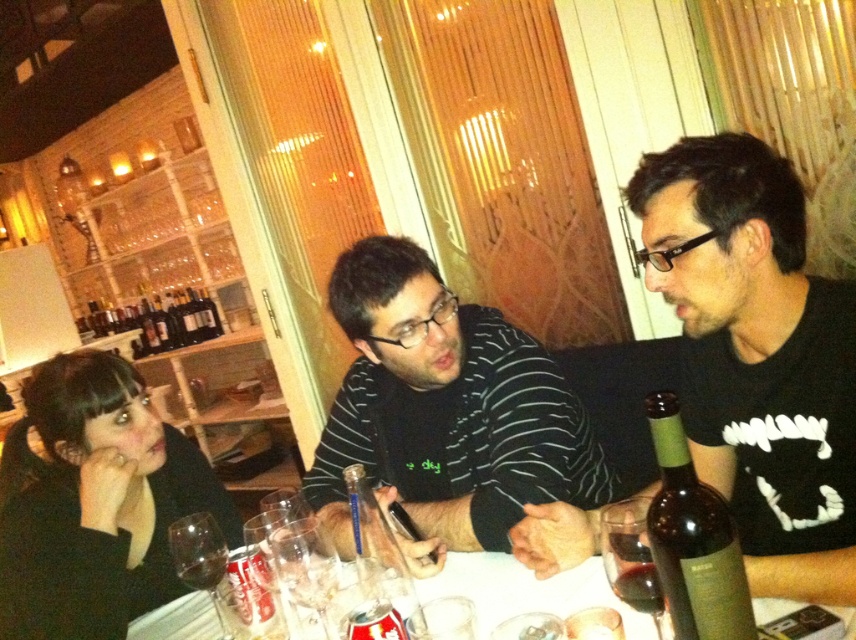
Does clear glass at table center lie behind dark brown glass bottle at center?

No, it is in front of dark brown glass bottle at center.

Does clear glass at table center appear on the right side of dark brown glass bottle at center?

Indeed, clear glass at table center is positioned on the right side of dark brown glass bottle at center.

Between point (193, 552) and point (143, 300), which one is positioned behind?

Point (143, 300)

This screenshot has width=856, height=640. In order to click on clear glass at table center in this screenshot , I will do `click(201, 566)`.

Can you confirm if clear glass bottle at center is smaller than dark brown glass bottle at center?

Indeed, clear glass bottle at center has a smaller size compared to dark brown glass bottle at center.

Is clear glass bottle at center to the left of dark brown glass bottle at center from the viewer's perspective?

In fact, clear glass bottle at center is to the right of dark brown glass bottle at center.

This screenshot has width=856, height=640. What do you see at coordinates (379, 554) in the screenshot?
I see `clear glass bottle at center` at bounding box center [379, 554].

You are a GUI agent. You are given a task and a screenshot of the screen. Output one action in this format:
    pyautogui.click(x=<x>, y=<y>)
    Task: Click on the clear glass bottle at center
    Image resolution: width=856 pixels, height=640 pixels.
    Given the screenshot: What is the action you would take?
    pyautogui.click(x=379, y=554)

Between clear plastic cups at center and transparent glass wine glass at lower left, which one has more height?

clear plastic cups at center is taller.

Is point (501, 600) closer to camera compared to point (207, 524)?

Yes.

Is point (854, 624) in front of point (215, 550)?

Yes.

Identify the location of clear plastic cups at center. This screenshot has height=640, width=856. (526, 589).